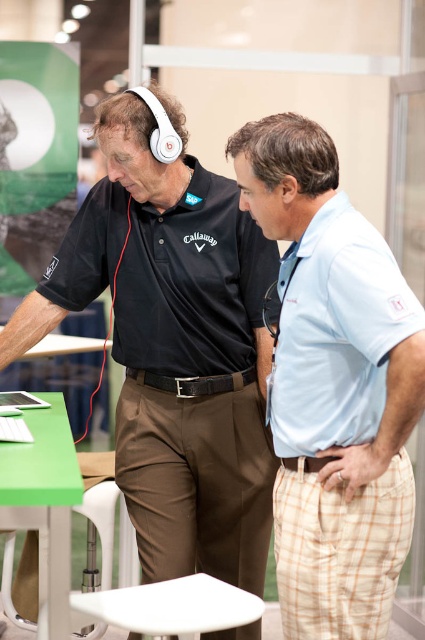
You are organizing a photo shoot and need to place a new prop between the light blue cotton polo shirt at center and the white plastic stool at lower center. Based on their current positions, which side of the stool should the prop be placed to maintain the existing arrangement?

The light blue cotton polo shirt at center is positioned on the right side of the white plastic stool at lower center, so placing the prop to the right of the stool would maintain the existing arrangement.

You are organizing a trade show booth and need to decide where to place promotional materials. The black matte headphones at upper left and the light blue cotton polo shirt at center are already displayed. Which object requires more space due to its size?

The black matte headphones at upper left requires more space because it has a larger size compared to the light blue cotton polo shirt at center.